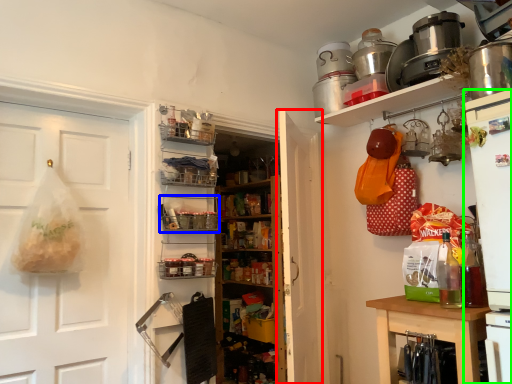
Question: Based on their relative distances, which object is farther from door (highlighted by a red box)? Choose from shelf (highlighted by a blue box) and appliance (highlighted by a green box).

Choices:
 (A) shelf
 (B) appliance

Answer: (B)